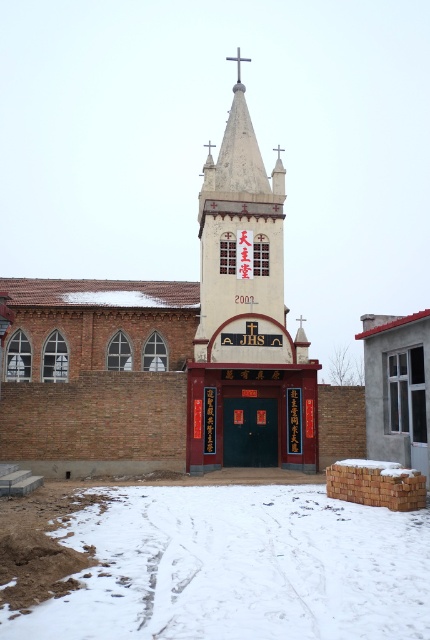
Can you confirm if white stucco church tower at center is shorter than white plastic cross at upper center?

No, white stucco church tower at center is not shorter than white plastic cross at upper center.

Identify the location of white stucco church tower at center. (245, 321).

From the picture: Can you confirm if white powdery snow at lower center is positioned to the right of white plastic cross at upper center?

In fact, white powdery snow at lower center is to the left of white plastic cross at upper center.

Does white powdery snow at lower center appear under white plastic cross at upper center?

Correct, white powdery snow at lower center is located below white plastic cross at upper center.

Where is `white powdery snow at lower center`? This screenshot has height=640, width=430. white powdery snow at lower center is located at coordinates (237, 566).

This screenshot has width=430, height=640. I want to click on white powdery snow at lower center, so click(237, 566).

Who is more distant from viewer, (x=117, y=602) or (x=239, y=259)?

Point (x=239, y=259)

Does white powdery snow at lower center appear on the left side of white stucco church tower at center?

Yes, white powdery snow at lower center is to the left of white stucco church tower at center.

Find the location of a particular element. white powdery snow at lower center is located at coordinates (237, 566).